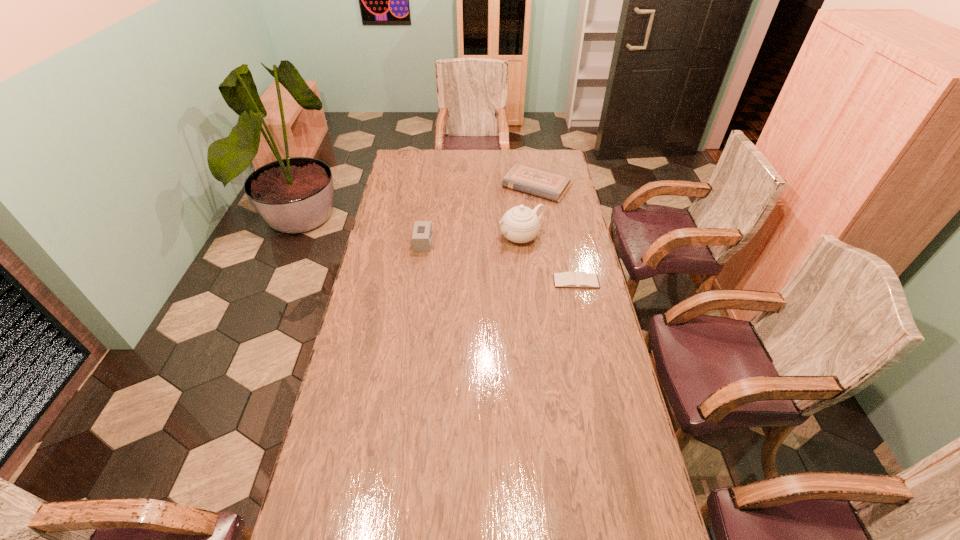
Locate an element on the screen. alarm clock is located at coordinates (422, 232).

This screenshot has width=960, height=540. Identify the location of the third shortest object. (422, 232).

Find the location of a particular element. diary is located at coordinates [569, 279].

You are a GUI agent. You are given a task and a screenshot of the screen. Output one action in this format:
    pyautogui.click(x=<x>, y=<y>)
    Task: Click on the shortest object
    
    Given the screenshot: What is the action you would take?
    pyautogui.click(x=569, y=279)

Find the location of a particular element. Bible is located at coordinates (537, 181).

Identify the location of the third tallest object. The width and height of the screenshot is (960, 540). (537, 181).

Where is `chinaware`? This screenshot has height=540, width=960. chinaware is located at coordinates (520, 224).

At what (x,y) coordinates should I click in order to perform the action: click on vacant space located on the front-facing side of the alarm clock. Please return your answer as a coordinate pair (x, y). The height and width of the screenshot is (540, 960). Looking at the image, I should click on (385, 243).

Locate an element on the screen. free space located on the front-facing side of the alarm clock is located at coordinates (377, 243).

Find the location of a particular element. The image size is (960, 540). free space located on the front-facing side of the alarm clock is located at coordinates (380, 243).